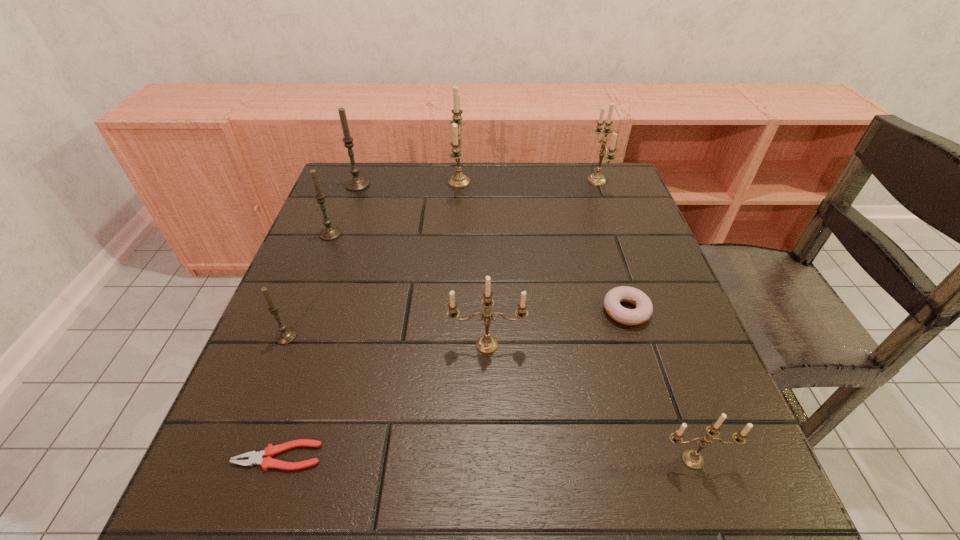
The width and height of the screenshot is (960, 540). Identify the location of vacant position located 0.190m on the front of the second shortest object. (660, 418).

Where is `free space located on the back of the shortest object`? This screenshot has width=960, height=540. free space located on the back of the shortest object is located at coordinates (340, 271).

The height and width of the screenshot is (540, 960). Identify the location of candle at the near edge. (691, 458).

Find the location of a particular element. The image size is (960, 540). pliers at the near edge is located at coordinates (267, 462).

Identify the location of pliers that is at the left edge. (267, 462).

Locate an element on the screen. The height and width of the screenshot is (540, 960). doughnut located in the right edge section of the desktop is located at coordinates (644, 308).

Image resolution: width=960 pixels, height=540 pixels. Identify the location of object at the far left corner. (356, 183).

This screenshot has height=540, width=960. I want to click on object that is at the near left corner, so click(267, 462).

Identify the location of object that is at the far right corner. (597, 178).

Locate an element on the screen. This screenshot has height=540, width=960. object that is at the near right corner is located at coordinates (691, 458).